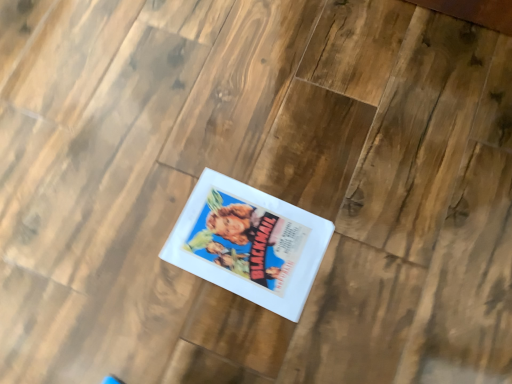
This screenshot has height=384, width=512. I want to click on vacant space that is to the left of white glossy paperback book at center, so point(147,274).